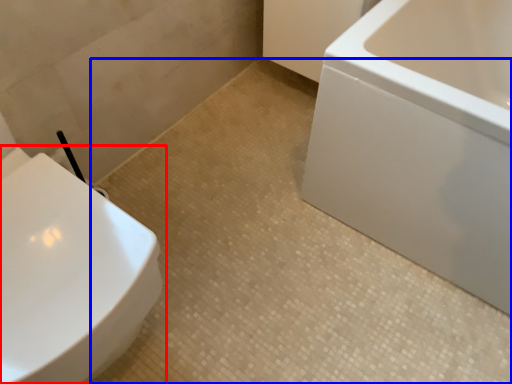
Question: Which object appears closest to the camera in this image, toilet (highlighted by a red box) or ceramic tile (highlighted by a blue box)?

Choices:
 (A) toilet
 (B) ceramic tile

Answer: (A)